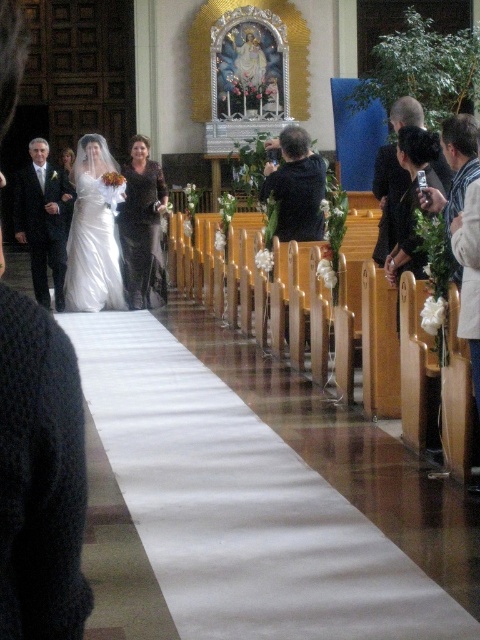
Who is taller, matte black suit at left or black lace dress at center?

With more height is matte black suit at left.

Is matte black suit at left bigger than black lace dress at center?

No, matte black suit at left is not bigger than black lace dress at center.

At what (x,y) coordinates should I click in order to perform the action: click on matte black suit at left. Please return your answer as a coordinate pair (x, y). This screenshot has height=640, width=480. Looking at the image, I should click on (39, 476).

Can you confirm if black lace dress at center is smaller than black matte jacket at center?

Correct, black lace dress at center occupies less space than black matte jacket at center.

Can you confirm if black lace dress at center is positioned to the right of black matte jacket at center?

No, black lace dress at center is not to the right of black matte jacket at center.

Find the location of a particular element. The height and width of the screenshot is (640, 480). black lace dress at center is located at coordinates (143, 228).

Find the location of a particular element. The width and height of the screenshot is (480, 640). matte black suit at left is located at coordinates (39, 476).